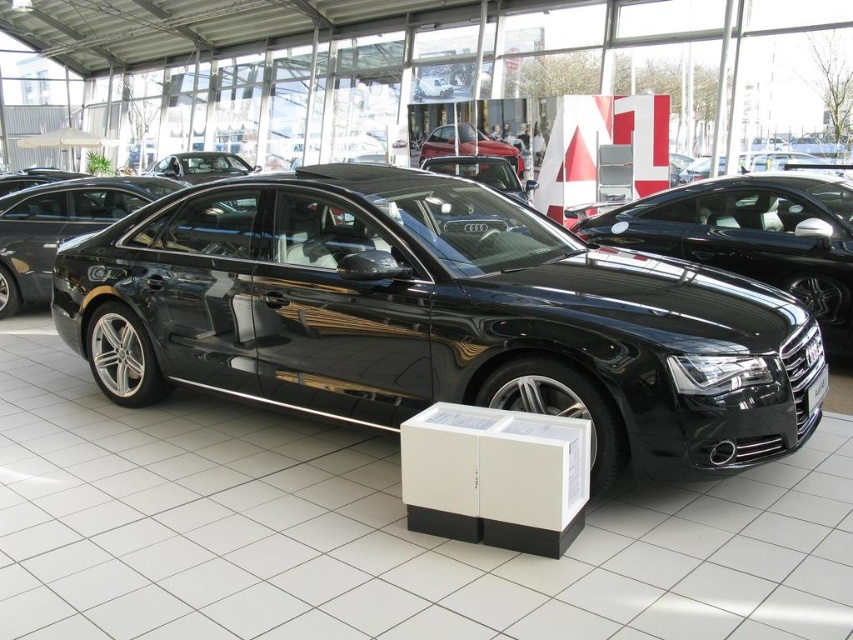
You are standing in the showroom and want to take a closer look at the cars. Which car, the glossy black sedan at center or the glossy metallic car at center, would you need to walk towards first if you want to examine the one nearest to you?

The glossy black sedan at center is closer to the viewer than the glossy metallic car at center, so you should walk towards the glossy black sedan at center first to examine the nearest car.

You are a delivery person with a 2.5 meter long package that needs to be placed between the glossy black sedan at center and the white display box in front of it. Can the package fit in that space?

The space between the glossy black sedan at center and the white display box in front of it is 2.74 meters, so the 2.5 meter long package can fit with some extra space remaining.